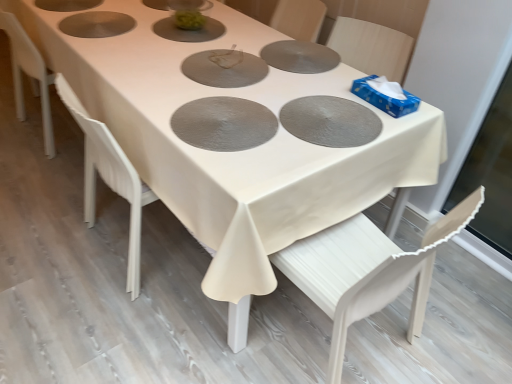
You are a GUI agent. You are given a task and a screenshot of the screen. Output one action in this format:
    pyautogui.click(x=<x>, y=<y>)
    Task: Click on the vacant area situated below matte gray pizza pan at center, which is the second pizza pan in bottom-to-top order (from a real-world perspective)
    The height and width of the screenshot is (384, 512).
    Given the screenshot: What is the action you would take?
    pyautogui.click(x=318, y=110)